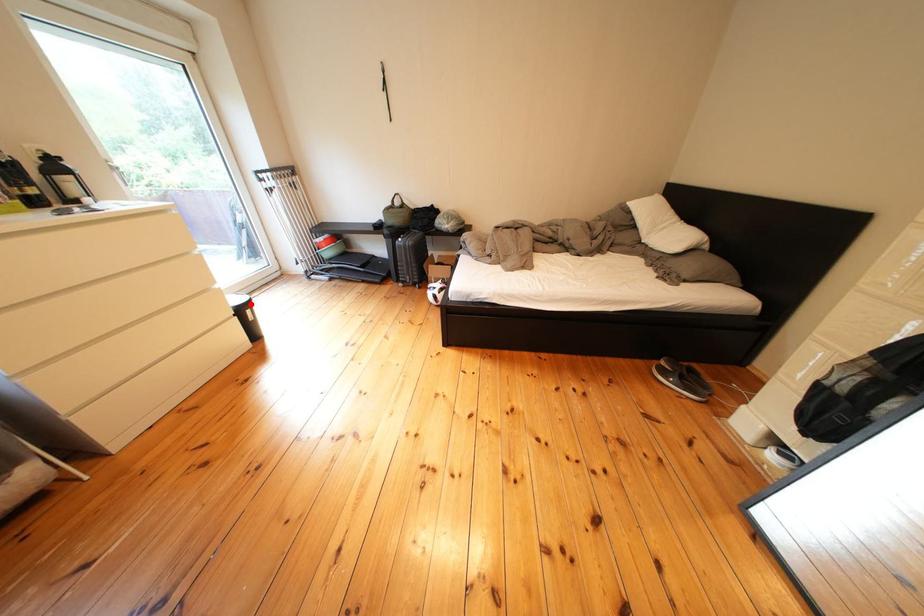
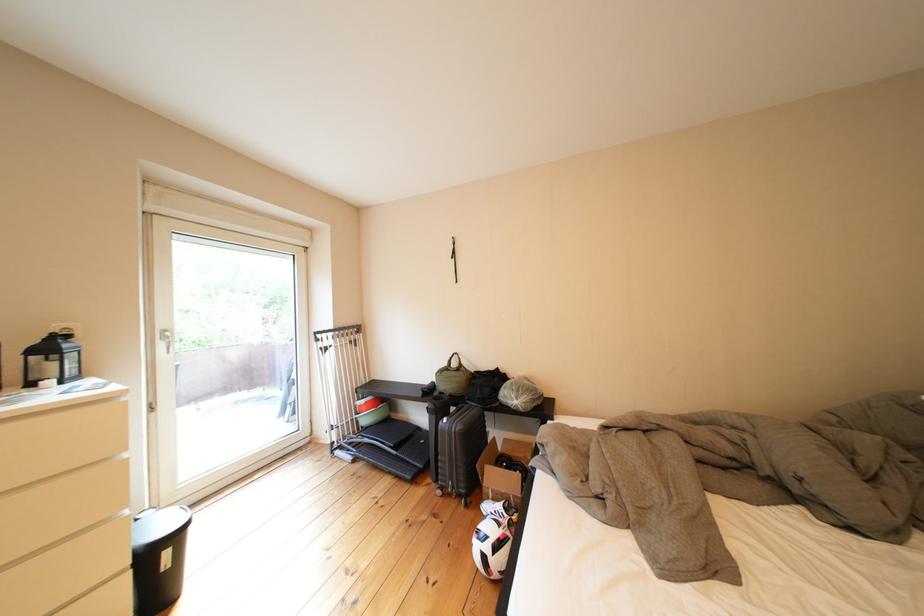
Find the pixel in the second image that matches the highlighted location in the first image.

(172, 533)